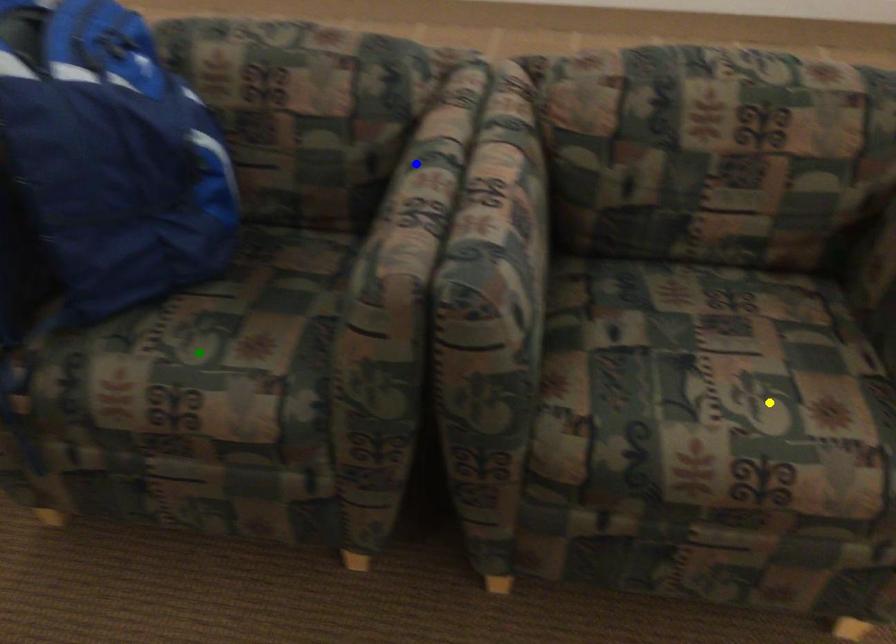
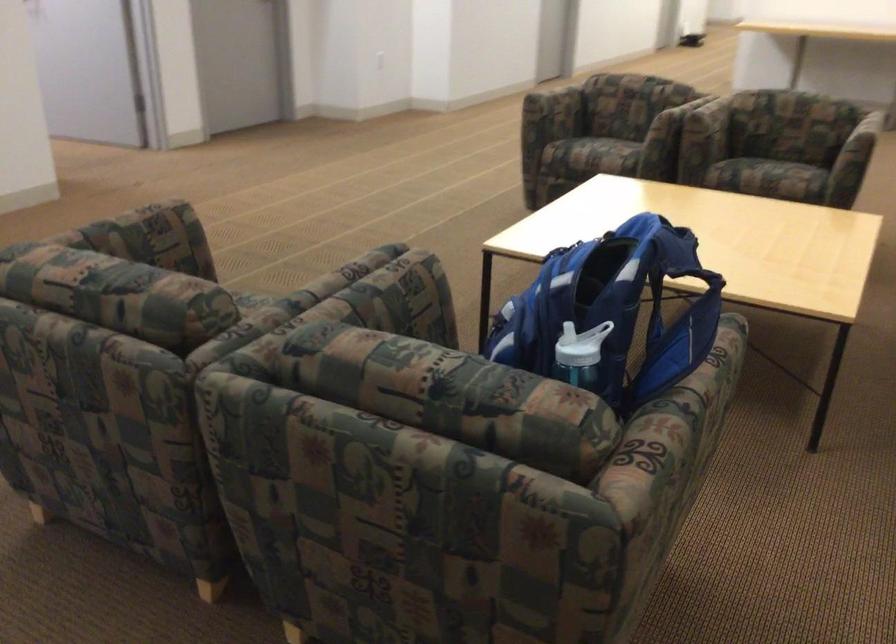
I am providing you with two images of the same scene from different viewpoints. Three points are marked in image1. Which point corresponds to a part or object that is occluded in image2?In image1, three points are marked. Which of them correspond to a part or object that is occluded in image2?Among the three points shown in image1, which one corresponds to a part or object that is no longer visible due to occlusion in image2?

Invisible in image2: green point.